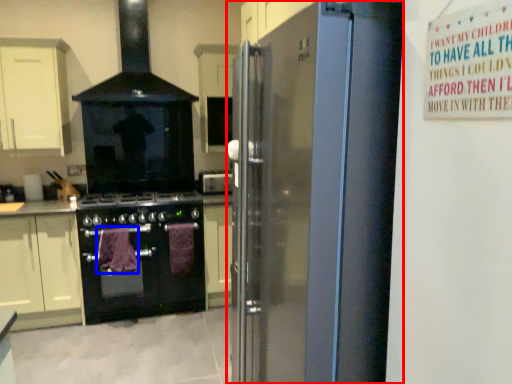
Question: Which object is further to the camera taking this photo, refrigerator (highlighted by a red box) or blanket (highlighted by a blue box)?

Choices:
 (A) refrigerator
 (B) blanket

Answer: (B)